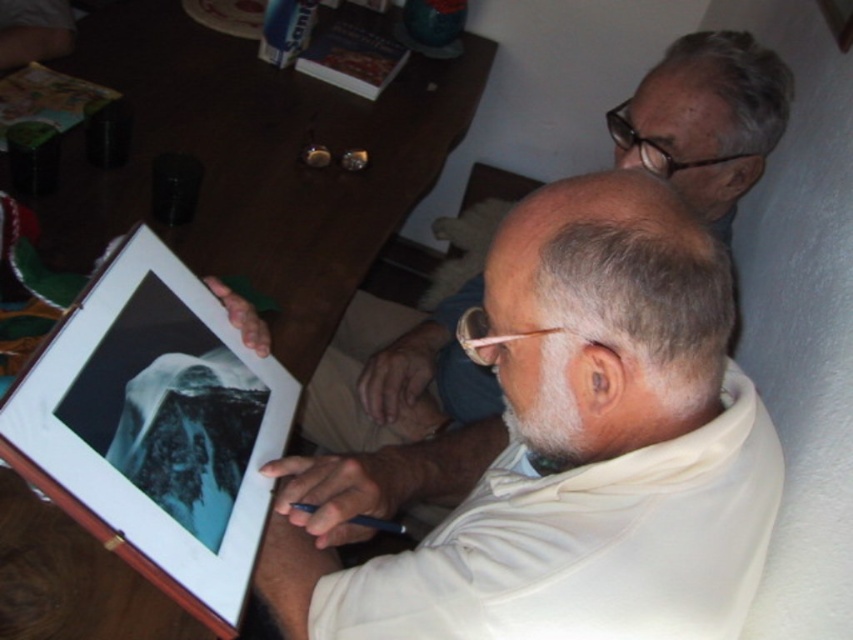
Does white matte shirt at center appear under white matte shirt at upper right?

Yes.

Can you confirm if white matte shirt at center is taller than white matte shirt at upper right?

Indeed, white matte shirt at center has a greater height compared to white matte shirt at upper right.

Image resolution: width=853 pixels, height=640 pixels. I want to click on white matte shirt at center, so click(x=576, y=444).